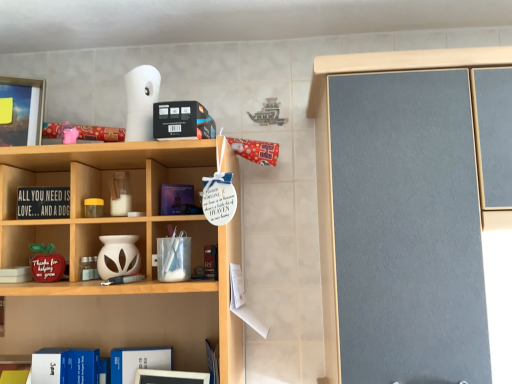
Question: Is clear glass jar at center, placed as the 1th cabinet when sorted from top to bottom, inside or outside of white matte vase at center, marked as the first cabinet in a bottom-to-top arrangement?

Choices:
 (A) inside
 (B) outside

Answer: (B)

Question: In terms of height, does clear glass jar at center, which appears as the 2th cabinet when ordered from the bottom, look taller or shorter compared to white matte vase at center, marked as the first cabinet in a bottom-to-top arrangement?

Choices:
 (A) short
 (B) tall

Answer: (B)

Question: Estimate the real-world distances between objects in this image. Which object is closer to the blue hardcover book at lower left, which ranks as the 2th book in left-to-right order?

Choices:
 (A) black wood sign at left, acting as the first book starting from the top
 (B) white matte vase at center, marked as the first cabinet in a bottom-to-top arrangement
 (C) clear glass jar at center, which appears as the 2th cabinet when ordered from the bottom

Answer: (B)

Question: Estimate the real-world distances between objects in this image. Which object is farther from the black wood sign at left, positioned as the first book in left-to-right order?

Choices:
 (A) clear glass jar at center, which appears as the 2th cabinet when ordered from the bottom
 (B) white matte vase at center, marked as the first cabinet in a bottom-to-top arrangement
 (C) blue hardcover book at lower left, acting as the second book starting from the top

Answer: (C)